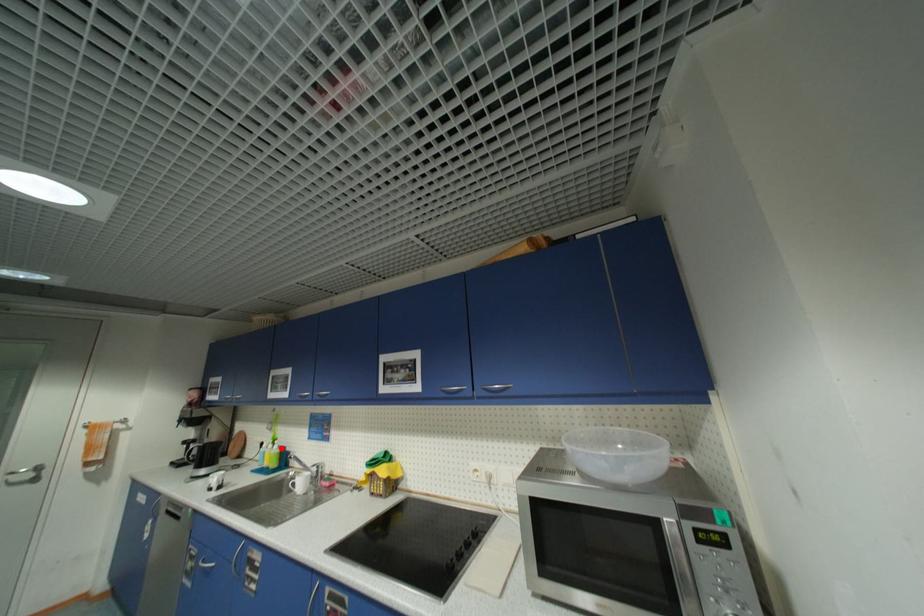
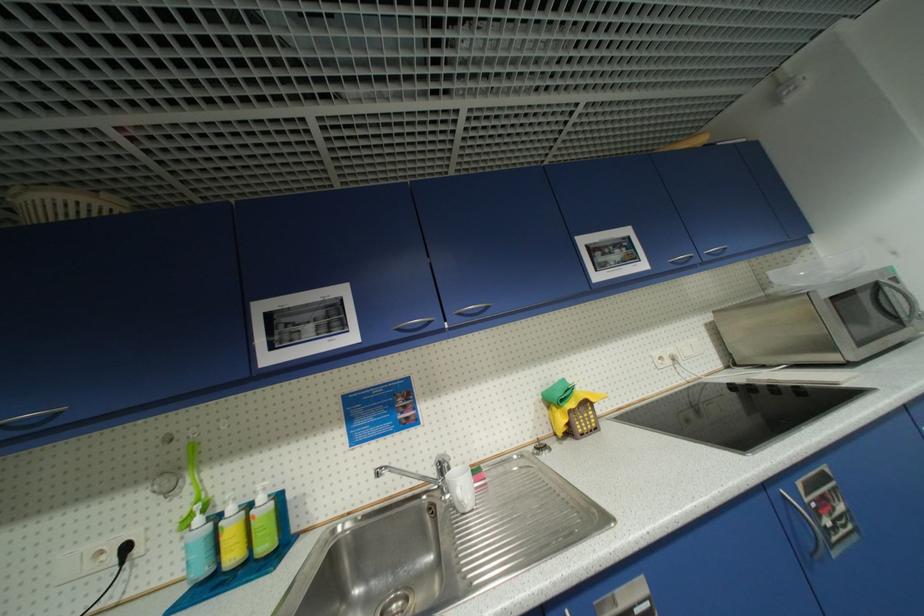
Locate, in the second image, the point that corresponds to the highlighted location in the first image.

(266, 500)